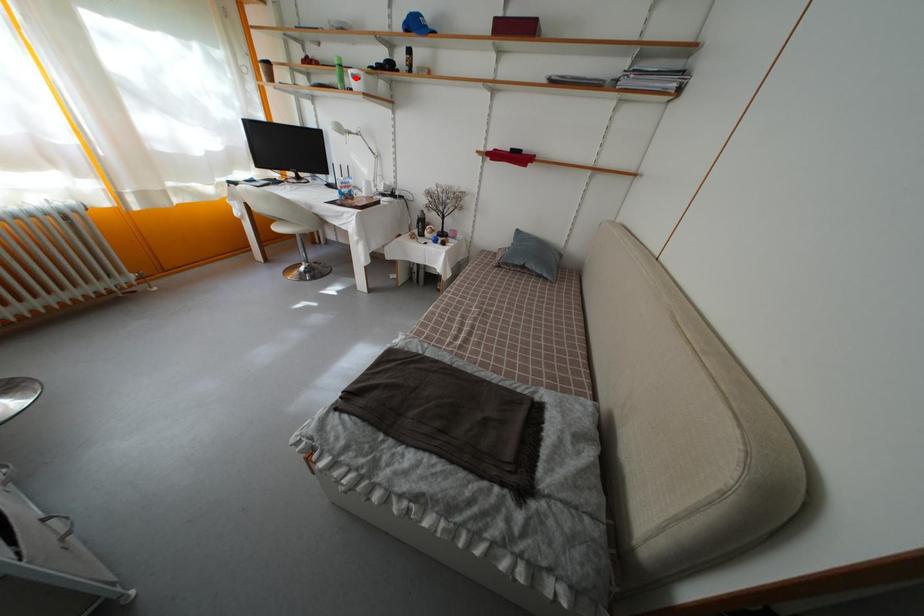
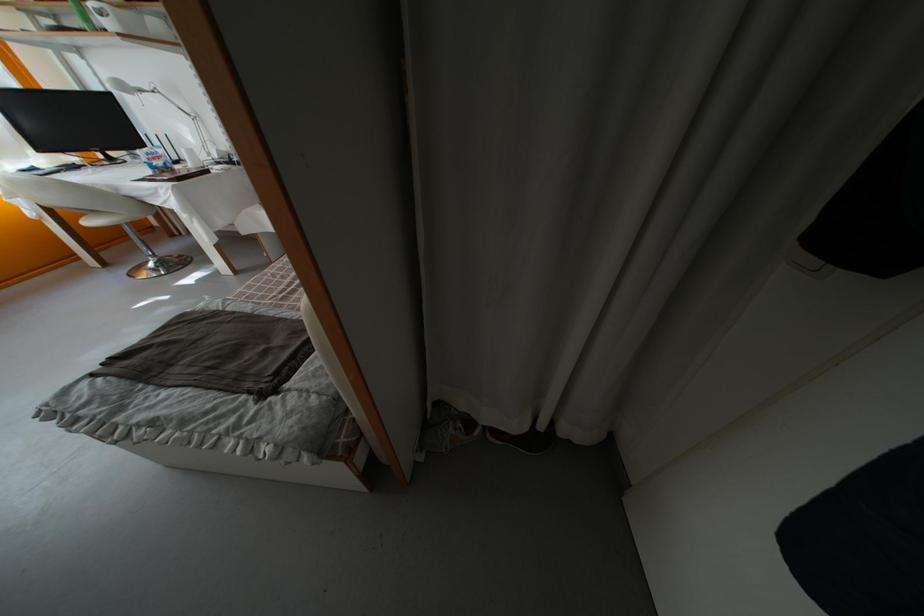
Question: I am providing you with two images of the same scene from different viewpoints. A red point is marked on the first image. At the location where the point appears in image 1, is it still visible in image 2?

Choices:
 (A) Yes
 (B) No

Answer: (A)